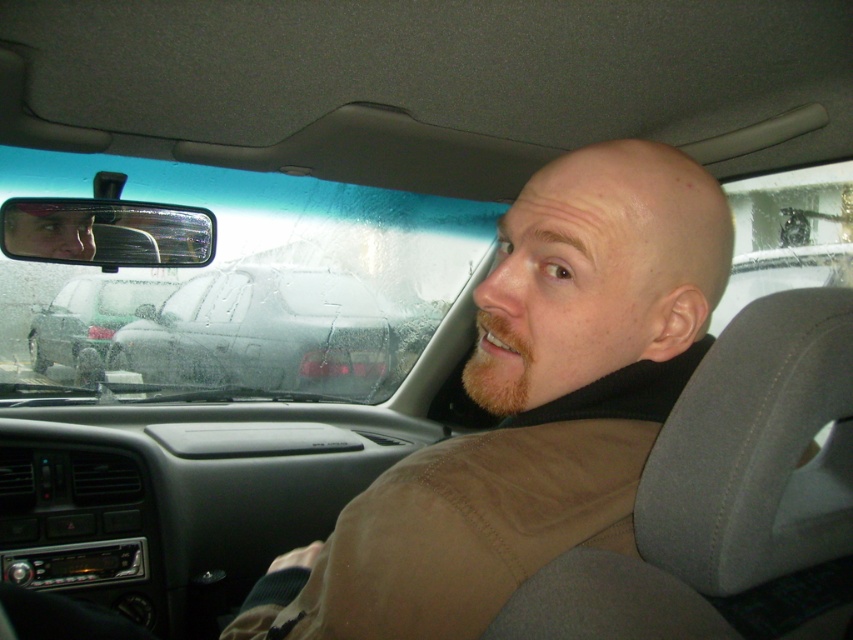
Question: Which point appears closest to the camera in this image?

Choices:
 (A) (128, 310)
 (B) (67, 189)
 (C) (608, 545)

Answer: (C)

Question: Is brown cotton shirt at center smaller than smokey gray car at center?

Choices:
 (A) yes
 (B) no

Answer: (A)

Question: Is brown cotton shirt at center positioned in front of smokey gray car at center?

Choices:
 (A) yes
 (B) no

Answer: (A)

Question: Is brown cotton shirt at center above satin black sedan at rear?

Choices:
 (A) yes
 (B) no

Answer: (B)

Question: Which point appears closest to the camera in this image?

Choices:
 (A) (515, 314)
 (B) (148, 280)

Answer: (A)

Question: Which point is farther to the camera?

Choices:
 (A) (50, 358)
 (B) (366, 243)
 (C) (706, 248)
 (D) (386, 356)

Answer: (B)